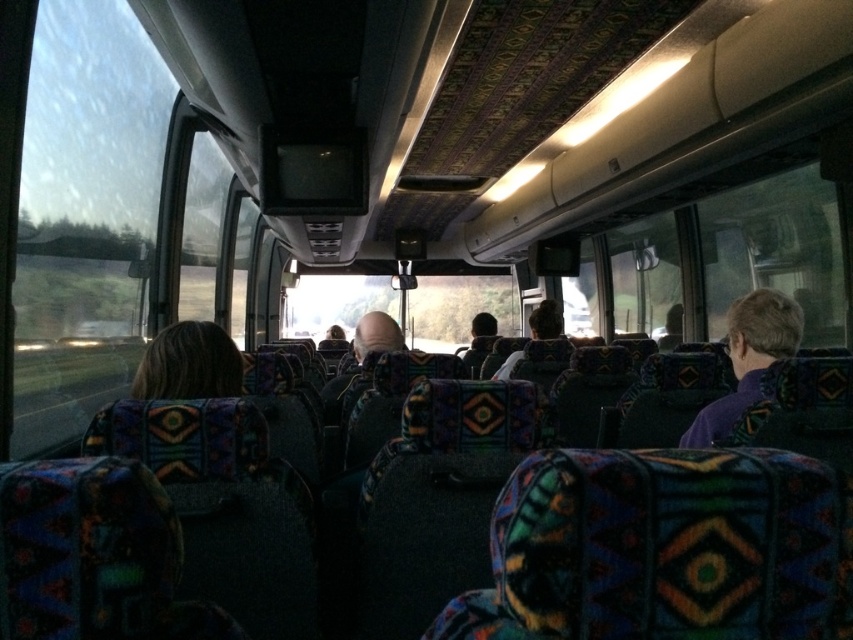
You are a passenger on the bus and want to place your hat on the purple fabric at right. However, you notice the smooth bald head at center is in the way. Can you place your hat there without disturbing anyone?

The purple fabric at right is positioned over the smooth bald head at center, so placing the hat there would require moving the smooth bald head at center, which is occupied by a person. Therefore, you cannot place your hat there without disturbing the person with the smooth bald head at center.

You are a passenger sitting in the bus and want to check if the purple fabric at right is nearer to you than the smooth bald head at center. Can you confirm this?

The purple fabric at right is closer to the viewer than smooth bald head at center, so yes, the purple fabric at right is nearer to you than the smooth bald head at center.

You are a passenger on a bus and want to know if the person sitting directly in front of you has hair. Based on the description, can you determine if the person with blonde hair at center has shorter hair than the person with the smooth bald head at center?

The blonde hair at center is shorter than the smooth bald head at center, so yes, the person with blonde hair at center has shorter hair than the person with the smooth bald head at center.